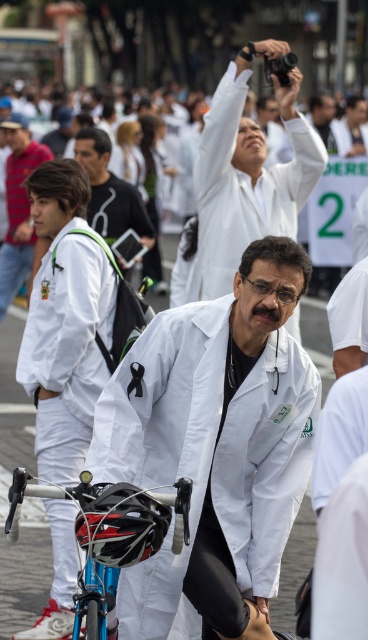
You are a photographer standing at the edge of the street. You want to capture a photo where the white lab coat at upper center and the shiny blue bicycle at center are both visible. Based on their heights, which object will appear taller in the photo?

The white lab coat at upper center will appear taller in the photo because it has a greater height compared to the shiny blue bicycle at center.

You are a photographer trying to capture a clear shot of the white lab coat at center and the black matte bicycle helmet at center. Which object should you zoom in on to ensure both are in focus without changing your position?

The black matte bicycle helmet at center is smaller than the white lab coat at center. To ensure both are in focus, you should zoom in on the smaller object, the black matte bicycle helmet at center, so its details are clearer while the larger white lab coat at center remains in frame.